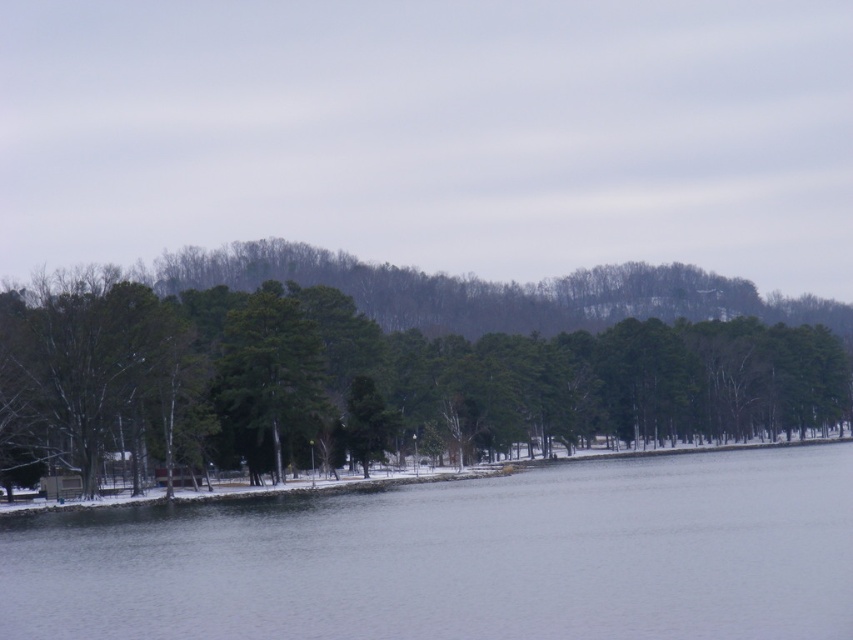
Question: Is green matte tree at left to the left of green matte tree at center from the viewer's perspective?

Choices:
 (A) yes
 (B) no

Answer: (B)

Question: Does green matte tree at left lie in front of green matte tree at center?

Choices:
 (A) yes
 (B) no

Answer: (A)

Question: Estimate the real-world distances between objects in this image. Which object is closer to the green matte tree at center?

Choices:
 (A) gray/smooth water at center
 (B) green matte tree at left

Answer: (B)

Question: Which point is closer to the camera taking this photo?

Choices:
 (A) (83, 625)
 (B) (590, 339)

Answer: (A)

Question: Is green matte tree at left bigger than green matte tree at center?

Choices:
 (A) no
 (B) yes

Answer: (B)

Question: Considering the real-world distances, which object is farthest from the green matte tree at left?

Choices:
 (A) green matte tree at center
 (B) gray/smooth water at center

Answer: (B)